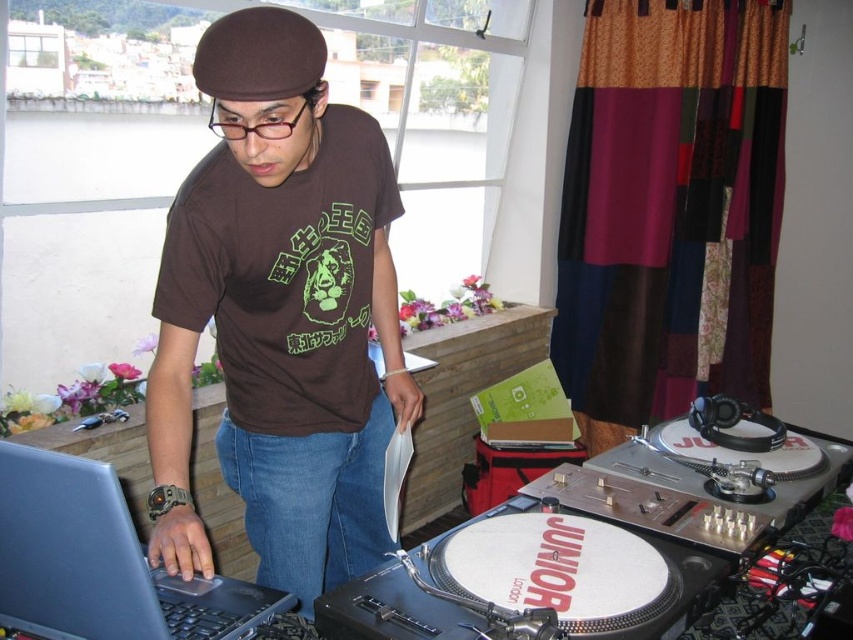
Between brown matte t-shirt at center and matte black laptop at left, which one appears on the right side from the viewer's perspective?

From the viewer's perspective, brown matte t-shirt at center appears more on the right side.

Between point (331, 232) and point (53, 508), which one is positioned in front?

Positioned in front is point (53, 508).

Find the location of a particular element. The width and height of the screenshot is (853, 640). brown matte t-shirt at center is located at coordinates (280, 314).

Between point (675, 568) and point (88, 564), which one is positioned in front?

Positioned in front is point (88, 564).

Which is more to the left, white vinyl turntable at lower right or matte black laptop at left?

matte black laptop at left

Between point (680, 513) and point (15, 524), which one is positioned behind?

Point (680, 513)

Locate an element on the screen. The height and width of the screenshot is (640, 853). white vinyl turntable at lower right is located at coordinates (581, 552).

Is brown matte t-shirt at center below white vinyl turntable at lower right?

Incorrect, brown matte t-shirt at center is not positioned below white vinyl turntable at lower right.

Does brown matte t-shirt at center have a greater height compared to white vinyl turntable at lower right?

Yes, brown matte t-shirt at center is taller than white vinyl turntable at lower right.

Who is more forward, (396, 186) or (624, 544)?

Point (624, 544) is more forward.

Locate an element on the screen. Image resolution: width=853 pixels, height=640 pixels. brown matte t-shirt at center is located at coordinates (280, 314).